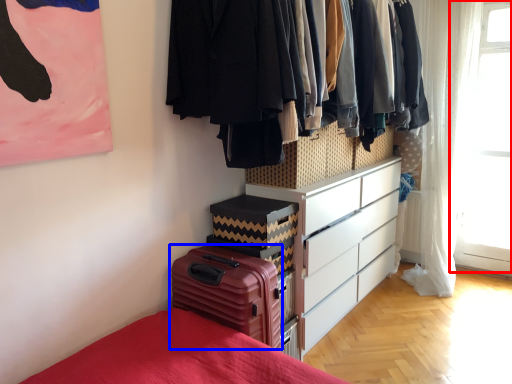
Question: Which object appears closest to the camera in this image, window screen (highlighted by a red box) or suitcase (highlighted by a blue box)?

Choices:
 (A) window screen
 (B) suitcase

Answer: (B)